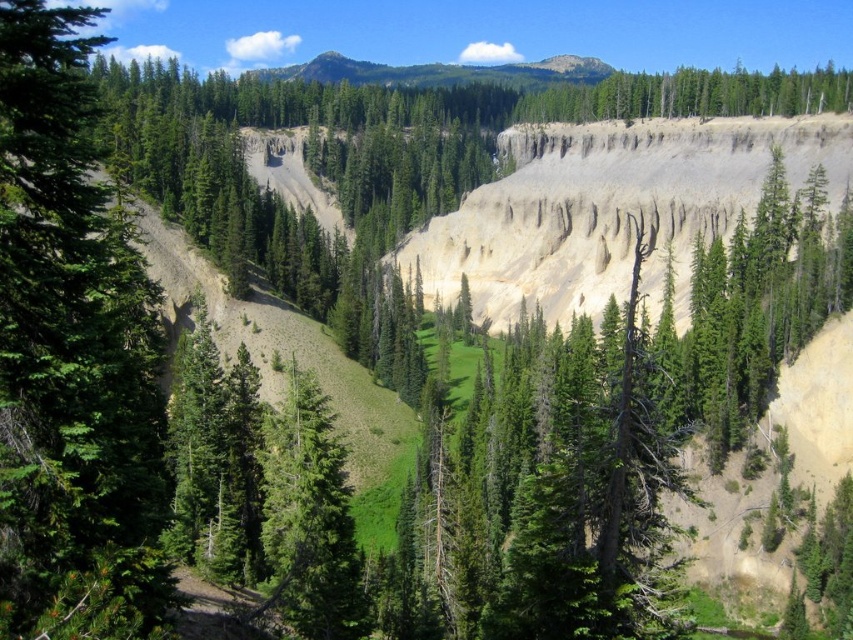
Question: Does green matte tree at left have a smaller size compared to green textured tree at upper center?

Choices:
 (A) yes
 (B) no

Answer: (A)

Question: Which point is closer to the camera?

Choices:
 (A) green forested mountain at upper center
 (B) green matte tree at left

Answer: (B)

Question: Does green textured tree at upper center appear under green forested mountain at upper center?

Choices:
 (A) no
 (B) yes

Answer: (B)

Question: Among these points, which one is nearest to the camera?

Choices:
 (A) (325, 60)
 (B) (524, 120)
 (C) (61, 348)

Answer: (C)

Question: Can you confirm if green matte tree at left is positioned to the left of green forested mountain at upper center?

Choices:
 (A) no
 (B) yes

Answer: (B)

Question: Estimate the real-world distances between objects in this image. Which object is closer to the green textured tree at upper center?

Choices:
 (A) green forested mountain at upper center
 (B) green matte tree at left

Answer: (A)